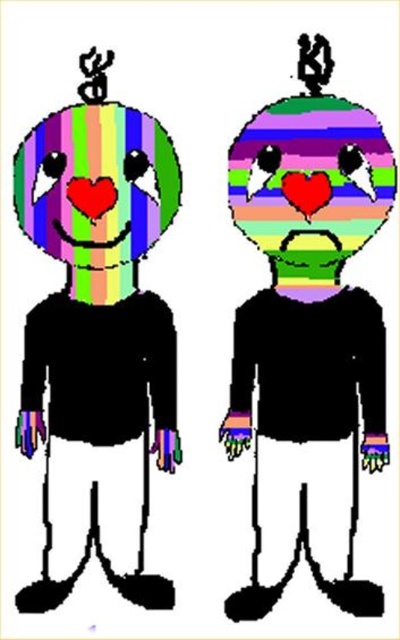
You are designing a greeting card and want to place both the striped rubber heart at center and the rainbow striped face at center in a vertical layout. Which object should you place higher up to ensure they don not overlap?

The striped rubber heart at center has a greater height compared to the rainbow striped face at center, so placing the striped rubber heart at center higher up will prevent overlapping since it is taller.

You are holding a striped rubber heart at center and want to place it on a shelf that is 3.5 feet away from you. Will the heart fit on the shelf if the shelf is exactly 3.5 feet away?

The striped rubber heart at center and viewer are 4.01 feet apart from each other, so the shelf is closer than the required distance. The heart will not fit on the shelf because it needs to be placed at least 4.01 feet away.

You are an observer looking at the two figures. Which object, the striped rubber heart at center or the rainbow striped face at center, appears closer to you?

The striped rubber heart at center appears closer to you because it is positioned in front of the rainbow striped face at center according to the description.